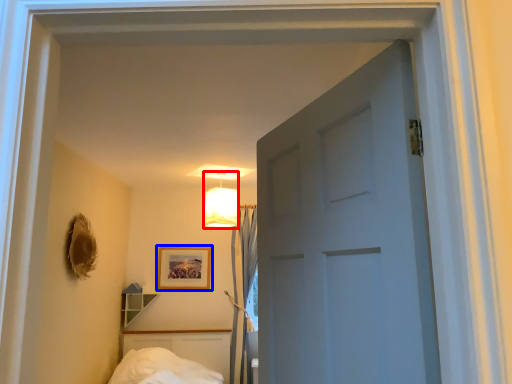
Question: Which of the following is the closest to the observer, lamp (highlighted by a red box) or picture frame (highlighted by a blue box)?

Choices:
 (A) lamp
 (B) picture frame

Answer: (A)